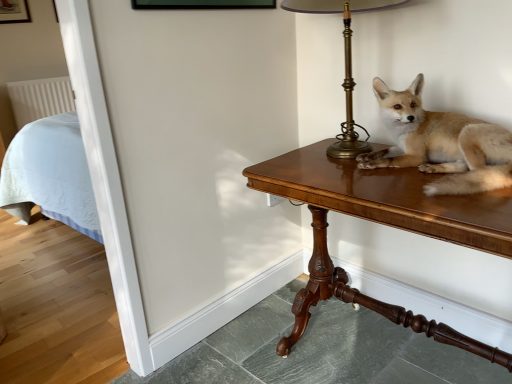
The image size is (512, 384). I want to click on vacant space underneath wooden table at right (from a real-world perspective), so click(x=372, y=348).